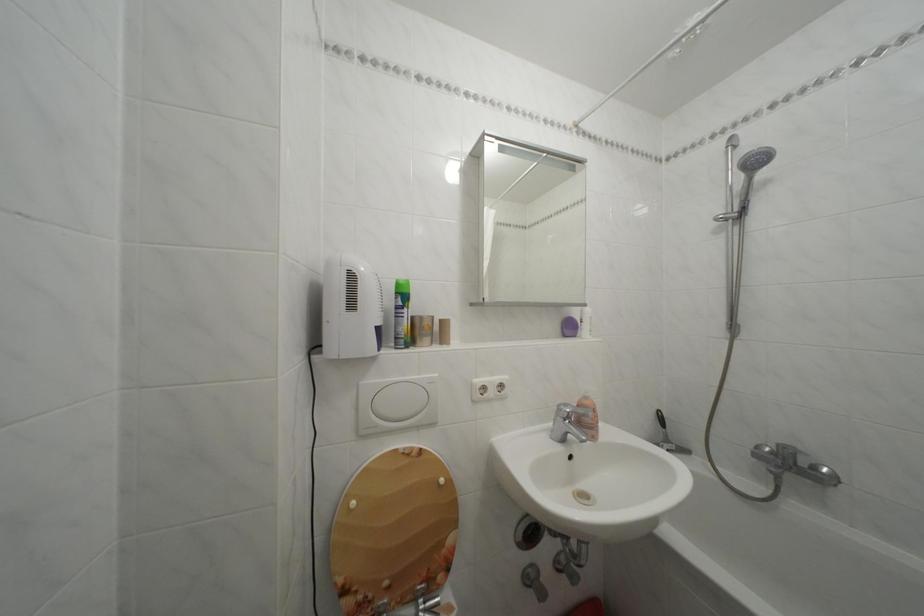
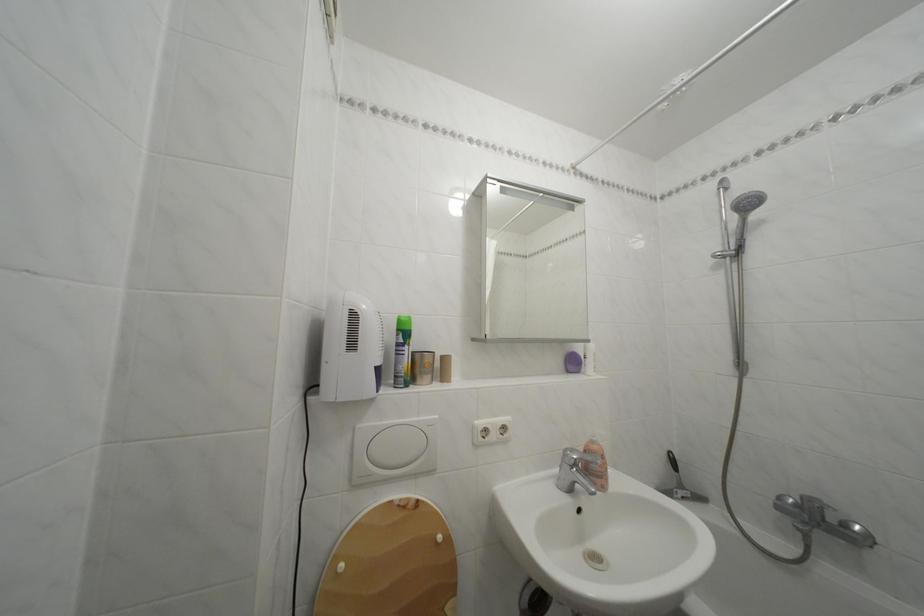
Where in the second image is the point corresponding to point (406, 300) from the first image?

(407, 336)